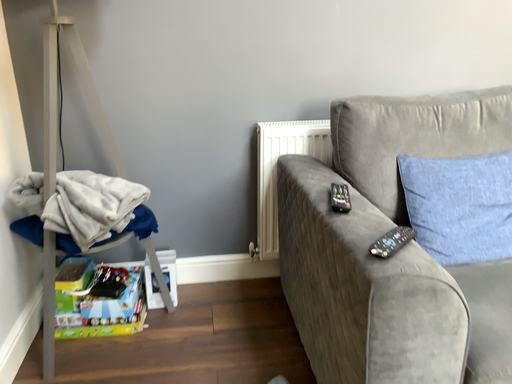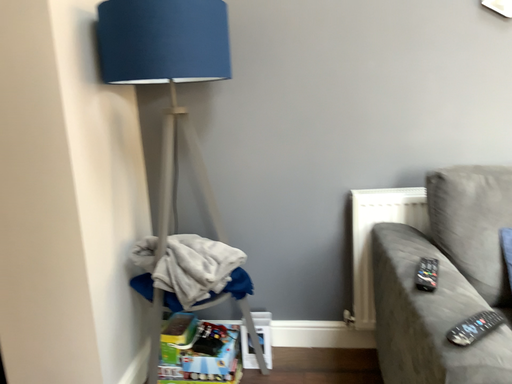
Question: How did the camera likely rotate when shooting the video?

Choices:
 (A) rotated left
 (B) rotated right

Answer: (A)